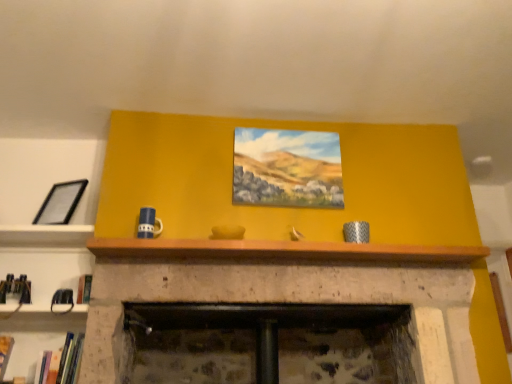
Question: Is wooden at upper center at the left side of hardcover book at lower left, which appears as the second book when viewed from the right?

Choices:
 (A) yes
 (B) no

Answer: (B)

Question: Is wooden at upper center thinner than hardcover book at lower left, the 1th book viewed from the left?

Choices:
 (A) no
 (B) yes

Answer: (A)

Question: Does wooden at upper center have a larger size compared to hardcover book at lower left, the 1th book viewed from the left?

Choices:
 (A) no
 (B) yes

Answer: (B)

Question: Would you say wooden at upper center contains hardcover book at lower left, the 1th book viewed from the left?

Choices:
 (A) yes
 (B) no

Answer: (B)

Question: From the image's perspective, is wooden at upper center under hardcover book at lower left, the 1th book viewed from the left?

Choices:
 (A) no
 (B) yes

Answer: (A)

Question: From a real-world perspective, is black matte picture frame at left, the 1th picture frame when ordered from left to right, physically located above or below hardcover book at lower left, which appears as the second book when viewed from the right?

Choices:
 (A) below
 (B) above

Answer: (B)

Question: Considering the relative positions of black matte picture frame at left, the 1th picture frame when ordered from left to right, and hardcover book at lower left, which appears as the second book when viewed from the right, in the image provided, is black matte picture frame at left, the 1th picture frame when ordered from left to right, to the left or to the right of hardcover book at lower left, which appears as the second book when viewed from the right,?

Choices:
 (A) right
 (B) left

Answer: (A)

Question: From the image's perspective, is black matte picture frame at left, the 1th picture frame when ordered from left to right, positioned above or below hardcover book at lower left, which appears as the second book when viewed from the right?

Choices:
 (A) above
 (B) below

Answer: (A)

Question: Considering their positions, is black matte picture frame at left, the 1th picture frame when ordered from left to right, located in front of or behind hardcover book at lower left, the 1th book viewed from the left?

Choices:
 (A) front
 (B) behind

Answer: (B)

Question: Is point (59, 377) closer or farther from the camera than point (3, 344)?

Choices:
 (A) closer
 (B) farther

Answer: (A)

Question: Do you think hardcover book at lower left, which is counted as the second book, starting from the left, is within hardcover book at lower left, which appears as the second book when viewed from the right, or outside of it?

Choices:
 (A) inside
 (B) outside

Answer: (B)

Question: Based on their positions, is hardcover book at lower left, which is counted as the second book, starting from the left, located to the left or right of hardcover book at lower left, which appears as the second book when viewed from the right?

Choices:
 (A) left
 (B) right

Answer: (B)

Question: From a real-world perspective, relative to hardcover book at lower left, the 1th book viewed from the left, is hardcover book at lower left, which is counted as the second book, starting from the left, vertically above or below?

Choices:
 (A) above
 (B) below

Answer: (A)

Question: From a real-world perspective, relative to hardcover book at lower left, which is counted as the second book, starting from the left, is hardcover book at lower left, the 1th book viewed from the left, vertically above or below?

Choices:
 (A) above
 (B) below

Answer: (B)

Question: From the image's perspective, is hardcover book at lower left, which appears as the second book when viewed from the right, positioned above or below hardcover book at lower left, which is counted as the second book, starting from the left?

Choices:
 (A) below
 (B) above

Answer: (A)